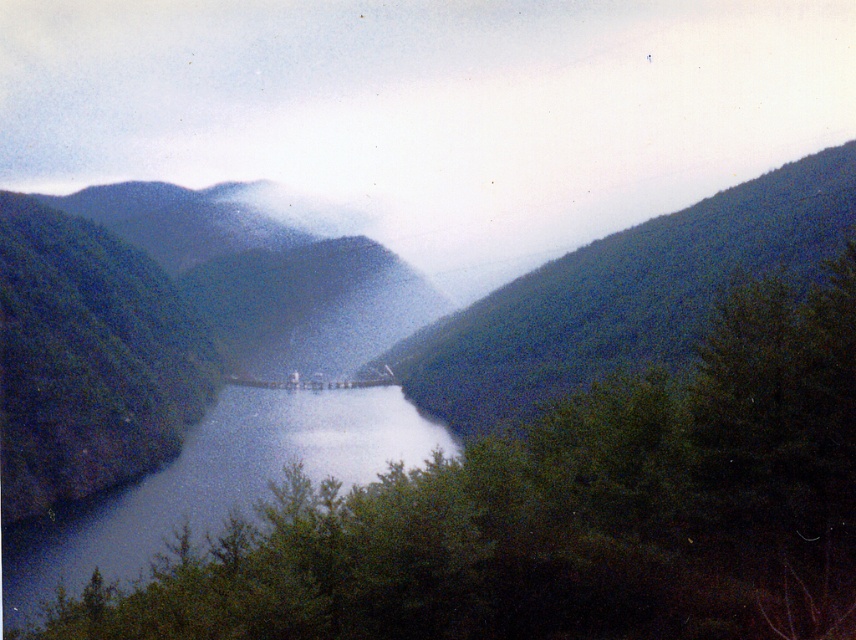
Which is more to the right, green leafy tree at center or green matte mountain at center?

green leafy tree at center is more to the right.

This screenshot has height=640, width=856. Describe the element at coordinates (565, 513) in the screenshot. I see `green leafy tree at center` at that location.

Find the location of a particular element. This screenshot has height=640, width=856. green leafy tree at center is located at coordinates (565, 513).

Can you confirm if green textured hillside at center is bigger than green matte mountain at center?

Yes.

Looking at this image, who is lower down, green textured hillside at center or green matte mountain at center?

green textured hillside at center

This screenshot has height=640, width=856. I want to click on green textured hillside at center, so click(x=623, y=296).

Does green matte mountain at center have a smaller size compared to blue glassy lake at center?

No.

Who is lower down, green matte mountain at center or blue glassy lake at center?

blue glassy lake at center is lower down.

Locate an element on the screen. This screenshot has width=856, height=640. green matte mountain at center is located at coordinates (266, 276).